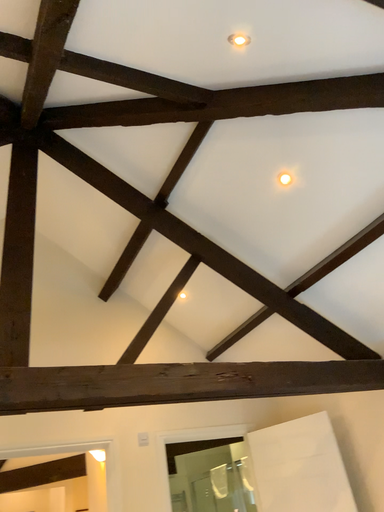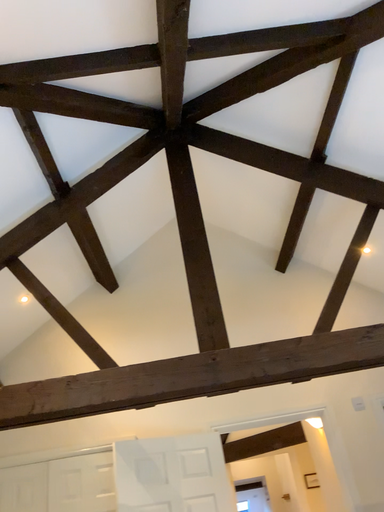
Question: Which way did the camera rotate in the video?

Choices:
 (A) rotated right
 (B) rotated left

Answer: (B)